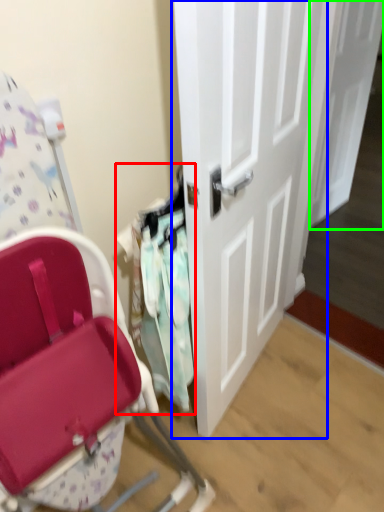
Question: Which object is positioned closest to laundry (highlighted by a red box)? Select from door (highlighted by a blue box) and door (highlighted by a green box).

Choices:
 (A) door
 (B) door

Answer: (A)